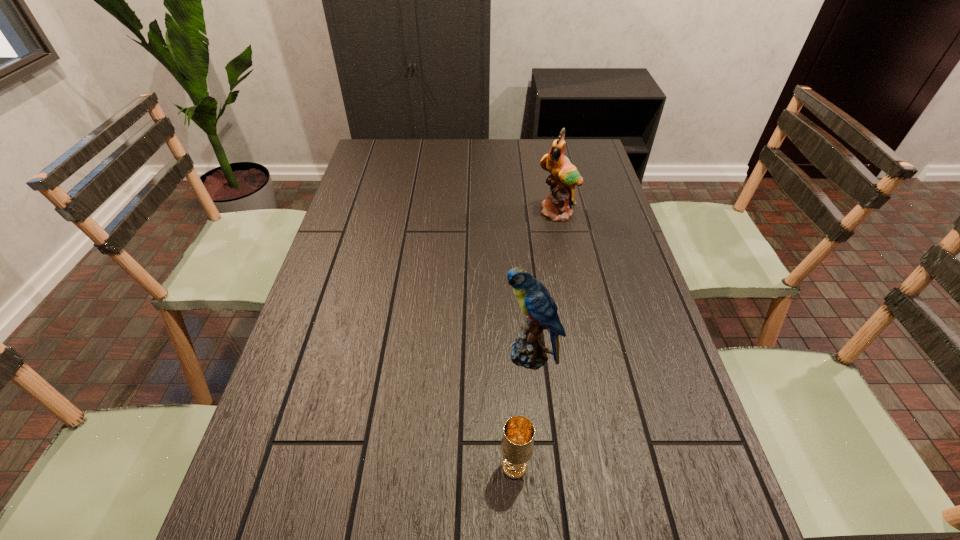
Find the location of a particular element. the right parrot is located at coordinates (564, 176).

In order to click on the farther parrot in this screenshot , I will do `click(564, 176)`.

Locate an element on the screen. the left parrot is located at coordinates (528, 350).

Locate an element on the screen. The width and height of the screenshot is (960, 540). the second farthest object is located at coordinates (528, 350).

Locate an element on the screen. This screenshot has width=960, height=540. the nearest object is located at coordinates (517, 445).

Identify the location of chalice. The height and width of the screenshot is (540, 960). (517, 445).

Where is `vacant region located 0.300m on the front-facing side of the rightmost object`? vacant region located 0.300m on the front-facing side of the rightmost object is located at coordinates (574, 293).

The height and width of the screenshot is (540, 960). Identify the location of vacant space located on the face of the left parrot. (335, 355).

Locate an element on the screen. vacant position located on the face of the left parrot is located at coordinates (482, 355).

The width and height of the screenshot is (960, 540). Find the location of `vacant region located on the face of the left parrot`. vacant region located on the face of the left parrot is located at coordinates (344, 355).